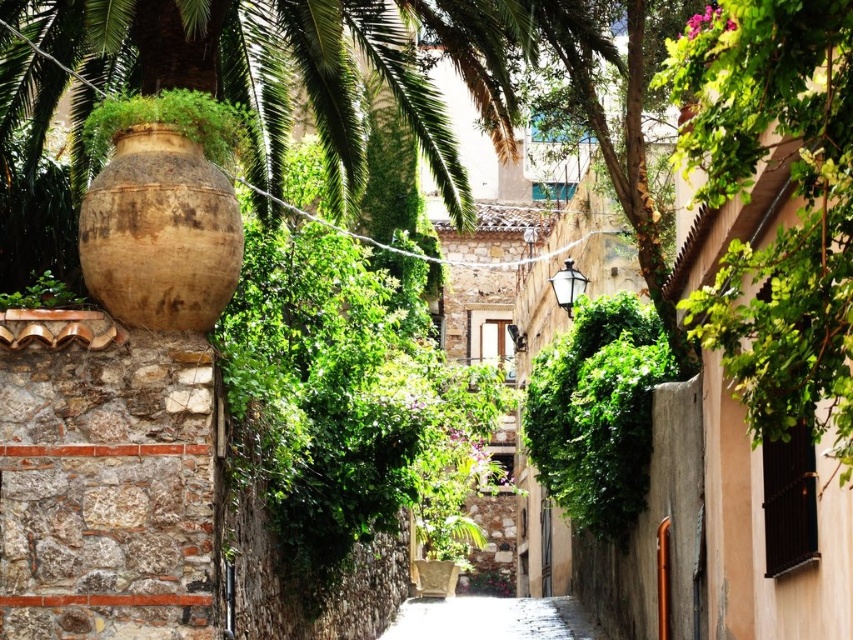
From the picture: You are a tourist walking down the narrow alleyway and want to take a photo of the green leafy plant at center and the smooth stone alley at center. Which object will appear closer to the camera in your photo?

The green leafy plant at center will appear closer to the camera in your photo because it is positioned in front of the smooth stone alley at center.

You are standing at the entrance of the alleyway and see the point marked at coordinates [596,412]. What is located at that point?

The point at [596,412] marks a green leafy plant at center.

You are a delivery person carrying a large package that requires a clear path. You see the green leafy plant at center and the smooth stone alley at center. Which object should you avoid to ensure your package can pass through without obstruction?

The green leafy plant at center has a smaller size compared to the smooth stone alley at center, so you should avoid the green leafy plant at center to ensure your package can pass through without obstruction.